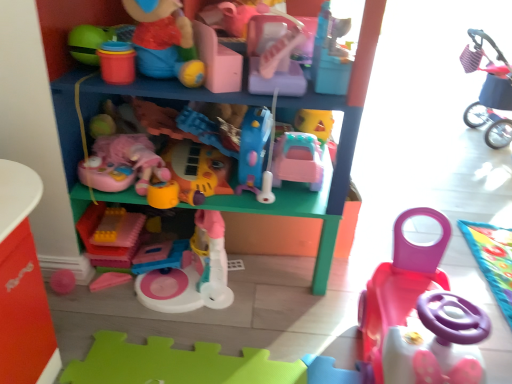
Question: From the image's perspective, is pink plastic toy at center, the 7th toy in the right-to-left sequence, positioned above or below matte plastic toy at upper center, the 5th toy viewed from the right?

Choices:
 (A) above
 (B) below

Answer: (B)

Question: Is pink plastic toy at center, marked as the 2th toy in a left-to-right arrangement, to the left or to the right of matte plastic toy at upper center, the 5th toy viewed from the right, in the image?

Choices:
 (A) left
 (B) right

Answer: (A)

Question: Based on their relative distances, which object is nearer to the pink plastic toy at center, the 6th toy when ordered from left to right?

Choices:
 (A) pink plastic car at center, the 4th toy from the right
 (B) matte plastic toy at upper center, the 5th toy viewed from the right
 (C) pink plastic toy at center, marked as the 2th toy in a left-to-right arrangement
 (D) pink plastic toy car at lower right, marked as the 2th toy in a right-to-left arrangement
 (E) plush pink stroller at upper right, which ranks as the 8th toy in left-to-right order

Answer: (D)

Question: Which object is the farthest from the pink plastic toy at center, marked as the 2th toy in a left-to-right arrangement?

Choices:
 (A) pink plastic car at center, arranged as the 5th toy when viewed from the left
 (B) pink plastic toy at center, the 6th toy when ordered from left to right
 (C) matte plastic toy at upper center, the 5th toy viewed from the right
 (D) matte plastic toy car at lower right
 (E) translucent yellow plastic blocks at center, placed as the eighth toy when sorted from right to left

Answer: (C)